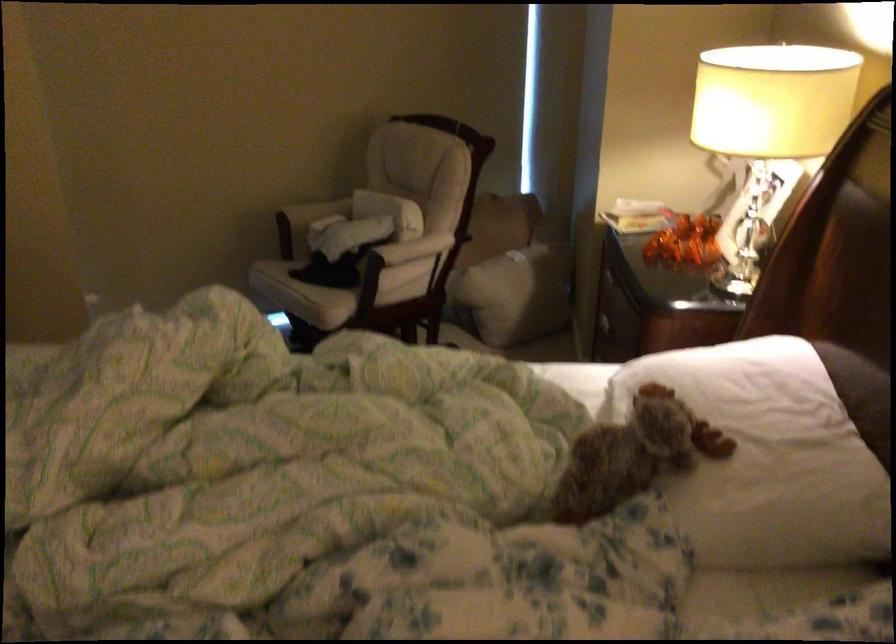
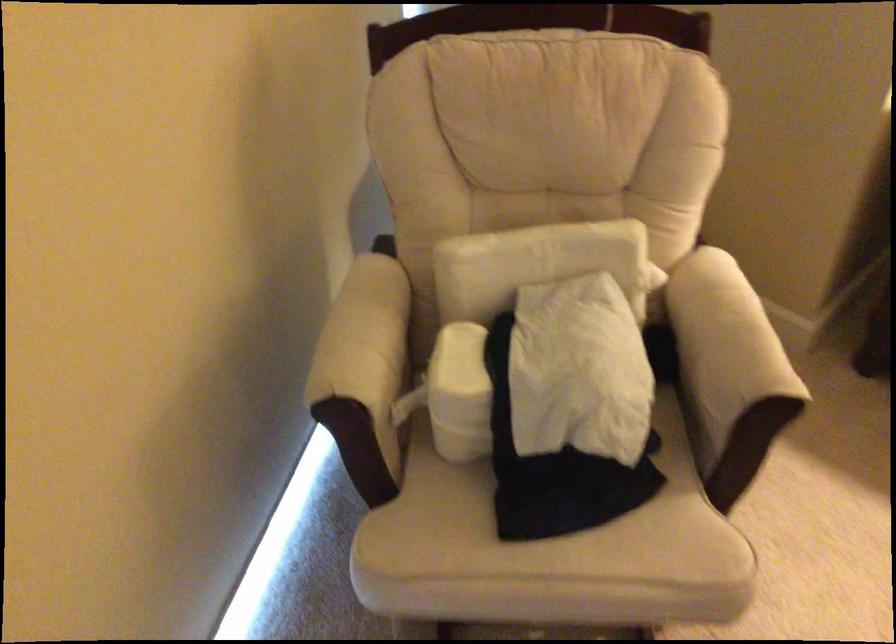
Locate, in the second image, the point that corresponds to pixel 297 277 in the first image.

(545, 535)